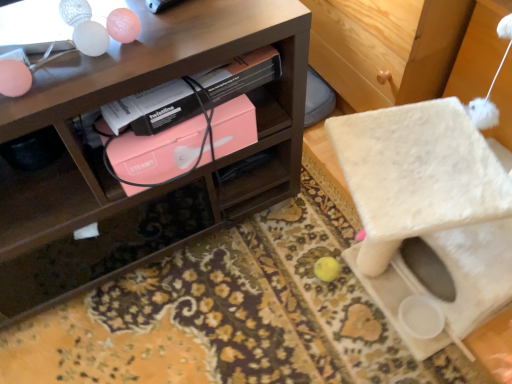
Describe the element at coordinates (157, 152) in the screenshot. The image size is (512, 384). I see `pink matte box at center` at that location.

Where is `pink matte box at center`? pink matte box at center is located at coordinates (153, 109).

Is wooden shelf at upper left positioned with its back to pink matte box at center?

That's not correct — wooden shelf at upper left is not looking away from pink matte box at center.

Is wooden shelf at upper left positioned far away from pink matte box at center?

That's not correct — wooden shelf at upper left is a little close to pink matte box at center.

Is point (6, 131) positioned behind point (176, 123)?

No, (6, 131) is in front of (176, 123).

Who is taller, wooden shelf at upper left or pink matte box at center?

With more height is wooden shelf at upper left.

Do you think pink matte box at center is within wooden shelf at upper left, or outside of it?

pink matte box at center is enclosed within wooden shelf at upper left.

Is pink matte box at center at the right side of wooden shelf at upper left?

Yes.

Considering the sizes of objects pink matte box at center and wooden shelf at upper left in the image provided, who is shorter, pink matte box at center or wooden shelf at upper left?

Standing shorter between the two is pink matte box at center.

Considering the sizes of objects pink matte box at center and pink matte box at center in the image provided, who is wider, pink matte box at center or pink matte box at center?

pink matte box at center.

Locate an element on the screen. Image resolution: width=512 pixels, height=384 pixels. book that appears in front of the pink matte box at center is located at coordinates (153, 109).

Between pink matte box at center and pink matte box at center, which one has smaller size?

Smaller between the two is pink matte box at center.

Considering the points (123, 135) and (3, 207), which point is in front, point (123, 135) or point (3, 207)?

Positioned in front is point (123, 135).

Would you say pink matte box at center contains wooden shelf at upper left?

No, wooden shelf at upper left is located outside of pink matte box at center.

Is pink matte box at center not close to wooden shelf at upper left?

They are positioned close to each other.

From the image's perspective, is pink matte box at center located above wooden shelf at upper left?

Incorrect, from the image's perspective, pink matte box at center is lower than wooden shelf at upper left.

Locate an element on the screen. The width and height of the screenshot is (512, 384). box on the right of wooden shelf at upper left is located at coordinates (157, 152).

From the image's perspective, relative to pink matte box at center, is wooden shelf at upper left above or below?

Clearly, from the image's perspective, wooden shelf at upper left is above pink matte box at center.

How different are the orientations of wooden shelf at upper left and pink matte box at center in degrees?

There is a 0.0815-degree angle between the facing directions of wooden shelf at upper left and pink matte box at center.

Can you confirm if wooden shelf at upper left is taller than pink matte box at center?

Yes.

Is pink matte box at center positioned with its back to pink matte box at center?

No.

Are pink matte box at center and pink matte box at center located far from each other?

They are positioned close to each other.

Which object is closer to the camera, pink matte box at center or pink matte box at center?

pink matte box at center is more forward.

From the image's perspective, would you say pink matte box at center is shown under pink matte box at center?

No, from the image's perspective, pink matte box at center is not beneath pink matte box at center.

Where is `shelf below the pink matte box at center (from a real-world perspective)`? shelf below the pink matte box at center (from a real-world perspective) is located at coordinates (137, 91).

The height and width of the screenshot is (384, 512). What are the coordinates of `shelf in front of the pink matte box at center` in the screenshot? It's located at pos(137,91).

From the picture: Which object lies nearer to the anchor point pink matte box at center, wooden shelf at upper left or pink matte box at center?

The object closer to pink matte box at center is pink matte box at center.

Considering their positions, is pink matte box at center positioned further to pink matte box at center than wooden shelf at upper left?

wooden shelf at upper left is positioned further to the anchor pink matte box at center.

When comparing their distances from pink matte box at center, does pink matte box at center or wooden shelf at upper left seem further?

wooden shelf at upper left lies further to pink matte box at center than the other object.

Estimate the real-world distances between objects in this image. Which object is closer to wooden shelf at upper left, pink matte box at center or pink matte box at center?

pink matte box at center.

Considering their positions, is pink matte box at center positioned further to wooden shelf at upper left than pink matte box at center?

pink matte box at center is further to wooden shelf at upper left.

From the image, which object appears to be farther from pink matte box at center, wooden shelf at upper left or pink matte box at center?

wooden shelf at upper left is further to pink matte box at center.

Image resolution: width=512 pixels, height=384 pixels. What are the coordinates of `box between wooden shelf at upper left and pink matte box at center from left to right` in the screenshot? It's located at tap(157, 152).